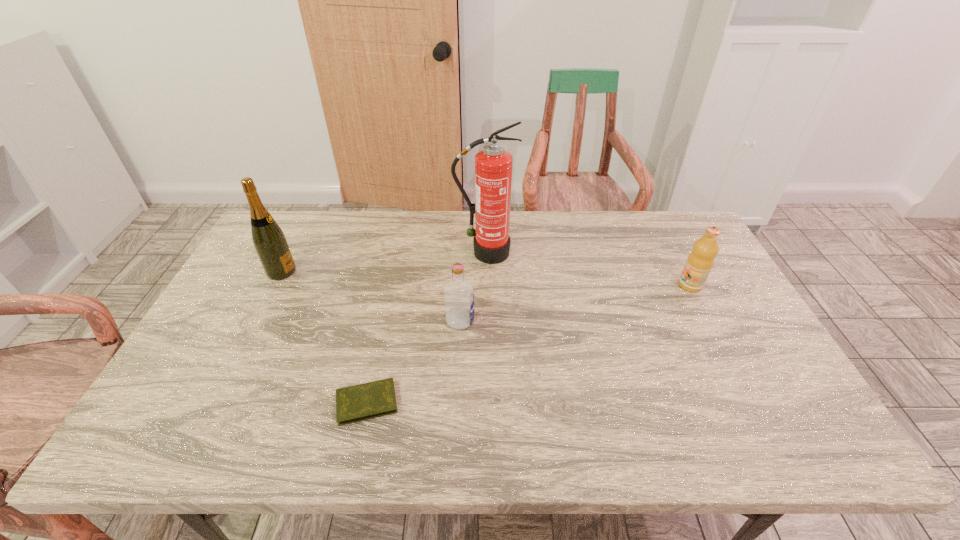
Identify the location of free spot located on the front label of the rightmost object. (662, 285).

Where is `vacant space situated 0.330m on the front label of the rightmost object`? This screenshot has height=540, width=960. vacant space situated 0.330m on the front label of the rightmost object is located at coordinates (569, 285).

This screenshot has height=540, width=960. I want to click on vacant region located on the label of the fourth farthest object, so click(528, 321).

Identify the location of vacant space located 0.330m on the right of the fourth object from right to left. The width and height of the screenshot is (960, 540). (540, 402).

In order to click on object located at the far edge in this screenshot , I will do `click(493, 165)`.

Find the location of `object present at the near edge`. object present at the near edge is located at coordinates (370, 400).

You are a GUI agent. You are given a task and a screenshot of the screen. Output one action in this format:
    pyautogui.click(x=<x>, y=<y>)
    Task: Click on the object at the left edge
    The width and height of the screenshot is (960, 540).
    Given the screenshot: What is the action you would take?
    pyautogui.click(x=270, y=243)

At what (x,y) coordinates should I click in order to perform the action: click on object that is at the right edge. Please return your answer as a coordinate pair (x, y). The height and width of the screenshot is (540, 960). Looking at the image, I should click on [700, 261].

The width and height of the screenshot is (960, 540). In order to click on vacant region at the far edge of the desktop in this screenshot , I will do `click(539, 245)`.

In the image, there is a desktop. At what (x,y) coordinates should I click in order to perform the action: click on free space at the near edge. Please return your answer as a coordinate pair (x, y). The width and height of the screenshot is (960, 540). Looking at the image, I should click on (712, 433).